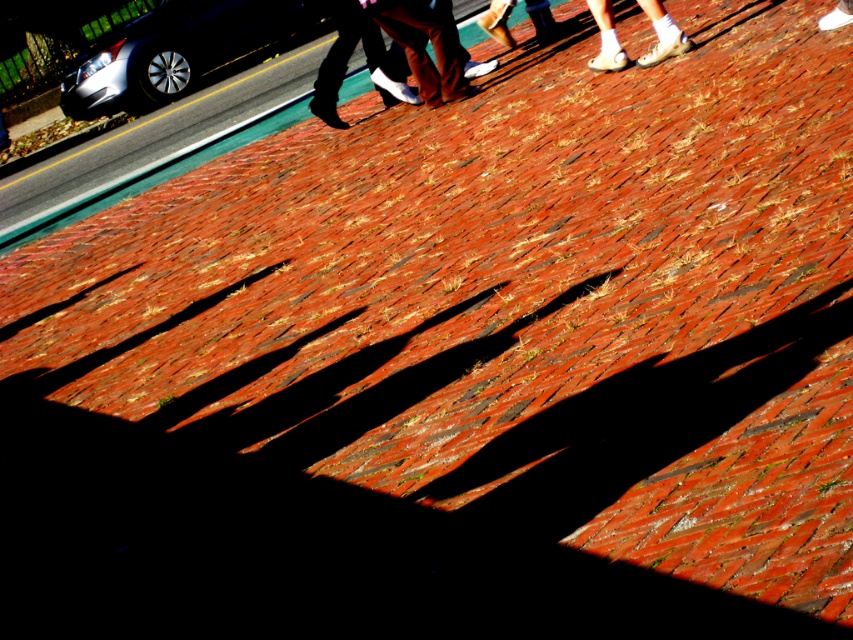
Does brown leather shoes at upper center have a greater height compared to matte brown pants at upper center?

Yes.

This screenshot has width=853, height=640. Describe the element at coordinates (424, 45) in the screenshot. I see `brown leather shoes at upper center` at that location.

Find the location of a particular element. This screenshot has height=640, width=853. brown leather shoes at upper center is located at coordinates (424, 45).

Is satin silver car at upper left smaller than matte brown pants at upper center?

No.

Is satin silver car at upper left bigger than matte brown pants at upper center?

Correct, satin silver car at upper left is larger in size than matte brown pants at upper center.

Measure the distance between satin silver car at upper left and camera.

A distance of 15.00 meters exists between satin silver car at upper left and camera.

The height and width of the screenshot is (640, 853). Find the location of `satin silver car at upper left`. satin silver car at upper left is located at coordinates (177, 51).

Is satin silver car at upper left taller than brown leather shoes at upper center?

Yes.

Does satin silver car at upper left have a lesser width compared to brown leather shoes at upper center?

No, satin silver car at upper left is not thinner than brown leather shoes at upper center.

You are a GUI agent. You are given a task and a screenshot of the screen. Output one action in this format:
    pyautogui.click(x=<x>, y=<y>)
    Task: Click on the satin silver car at upper left
    The width and height of the screenshot is (853, 640).
    Given the screenshot: What is the action you would take?
    pyautogui.click(x=177, y=51)